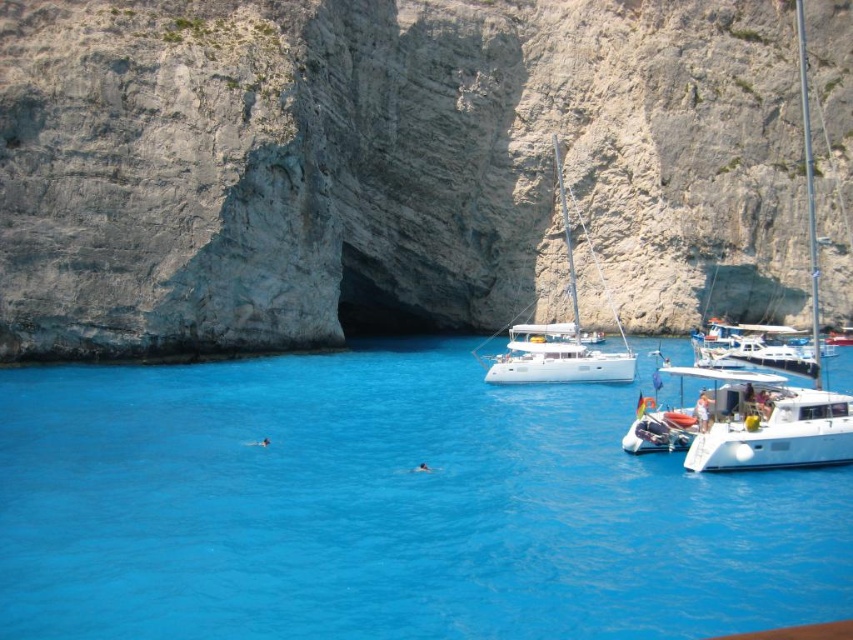
You are standing at the cliff edge looking out at the coastal scene. You notice two points marked on the image. The first point is at coordinates point (21, 621) and the second is at point (498, 358). Which point is closer to you as you stand at the cliff edge?

Point (21, 621) is in front of point (498, 358), so it is closer to you as you stand at the cliff edge.

You are planning to take a photo of the coastal scene. You have a camera that can only focus on objects up to 10 meters tall. Given that the white glossy sailboat at center is 12 meters tall, will the white glossy catamaran at lower right be in focus?

The white glossy catamaran at lower right is not as tall as the white glossy sailboat at center, which is 12 meters tall. Since the camera can focus up to 10 meters, the catamaran may still be in focus if its height is under 10 meters. However, without knowing the exact height of the catamaran, we cannot confirm for sure.